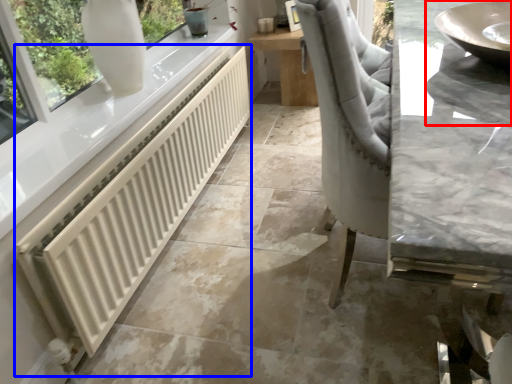
Question: Among these objects, which one is farthest to the camera, sink (highlighted by a red box) or radiator (highlighted by a blue box)?

Choices:
 (A) sink
 (B) radiator

Answer: (B)